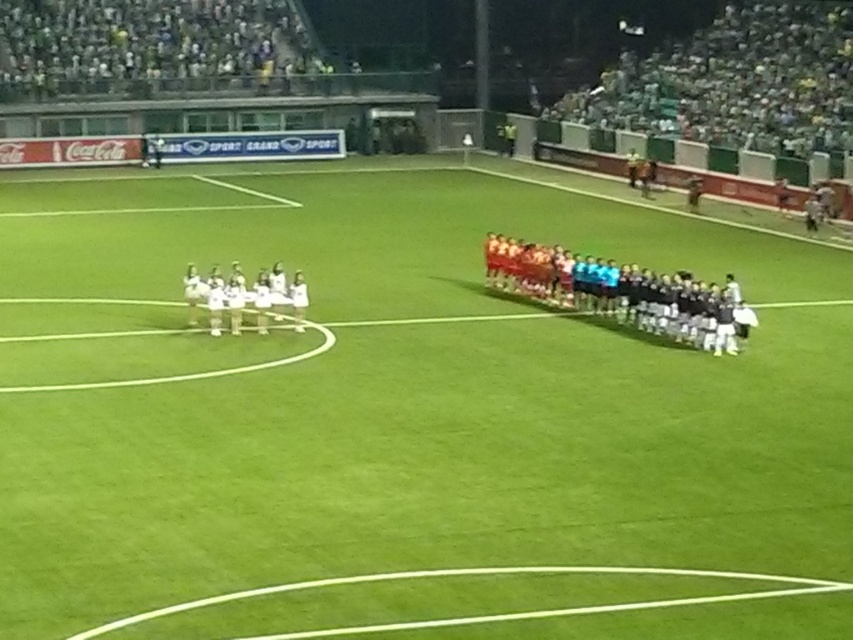
You are a drone operator trying to capture a birdseye view of the soccer field. The point marked at coordinates (392, 397) is crucial for framing the shot. What is located at this point?

The point marked at coordinates (392, 397) marks the green grass field at center, which is the central area of the soccer field where the pre match ceremony or national anthem is taking place.

You are a photographer positioned at the center of the soccer field during a prematch ceremony. You want to take a photo that includes both the point at coordinates point (525, 268) and point (329, 634). Which point is closer to your camera?

Point (329, 634) is closer to the photographer because the description states that point (525, 268) is further away from the viewer than point (329, 634).

You are a photographer positioned at the edge of the soccer field. You need to capture a photo that includes both the green grass field at center and the orange jersey at center. Based on their positions, which object should you frame first in your camera viewfinder to ensure both are in the shot?

Since the green grass field at center is to the left of orange jersey at center, you should frame the green grass field at center first as it is positioned to the left, ensuring both objects are included in the shot.